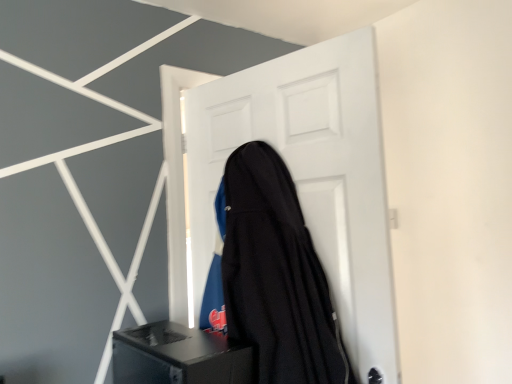
Question: Considering their positions, is white matte door at center located in front of or behind black fabric guitar case at center?

Choices:
 (A) behind
 (B) front

Answer: (A)

Question: From a real-world perspective, relative to black fabric guitar case at center, is white matte door at center vertically above or below?

Choices:
 (A) below
 (B) above

Answer: (B)

Question: Which is farther from the black matte speaker at lower center?

Choices:
 (A) black fabric guitar case at center
 (B) white matte door at center

Answer: (B)

Question: Considering the real-world distances, which object is farthest from the black matte speaker at lower center?

Choices:
 (A) white matte door at center
 (B) black fabric guitar case at center

Answer: (A)